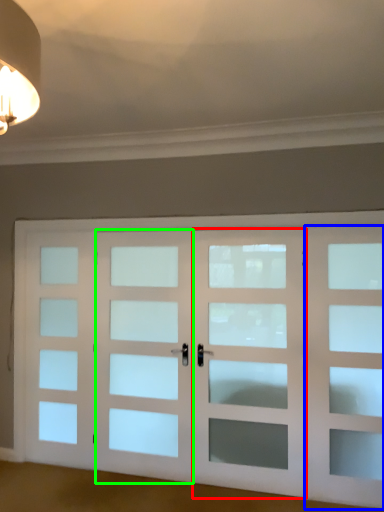
Question: Which object is positioned farthest from screen door (highlighted by a red box)? Select from screen door (highlighted by a blue box) and screen door (highlighted by a green box).

Choices:
 (A) screen door
 (B) screen door

Answer: (B)